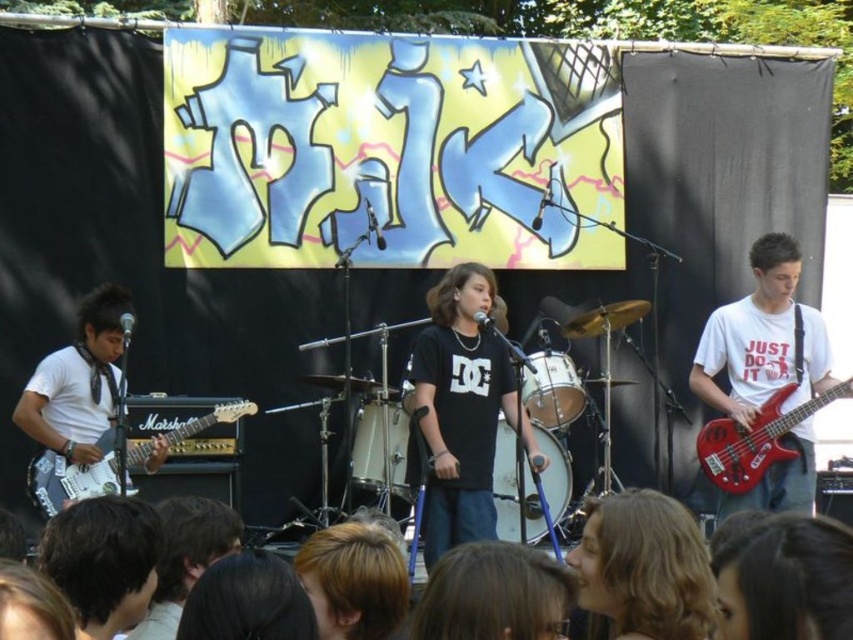
You are at the outdoor event and want to find the black matte shirt at center. According to the coordinates provided, where would you look relative to the image center?

The black matte shirt at center is located at coordinates point (462, 410), which means it is to the right and slightly above the image center.

You are a photographer at the live music event and want to capture a photo of the black matte shirt at center and the white matte guitar at left. Based on their positions, which object should be placed on the left side of the photo to ensure they are both visible?

The white matte guitar at left should be placed on the left side of the photo because the black matte shirt at center is positioned on the right side of it.